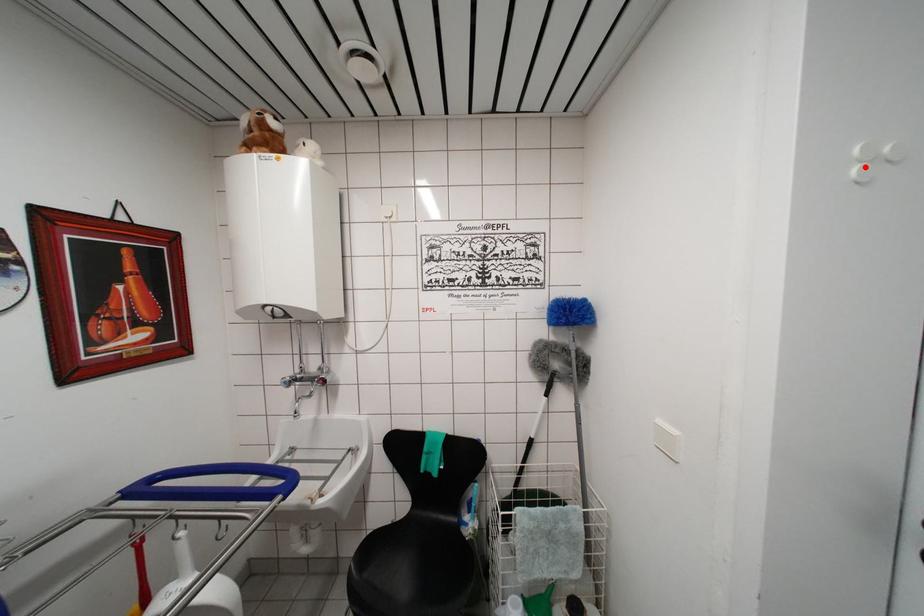
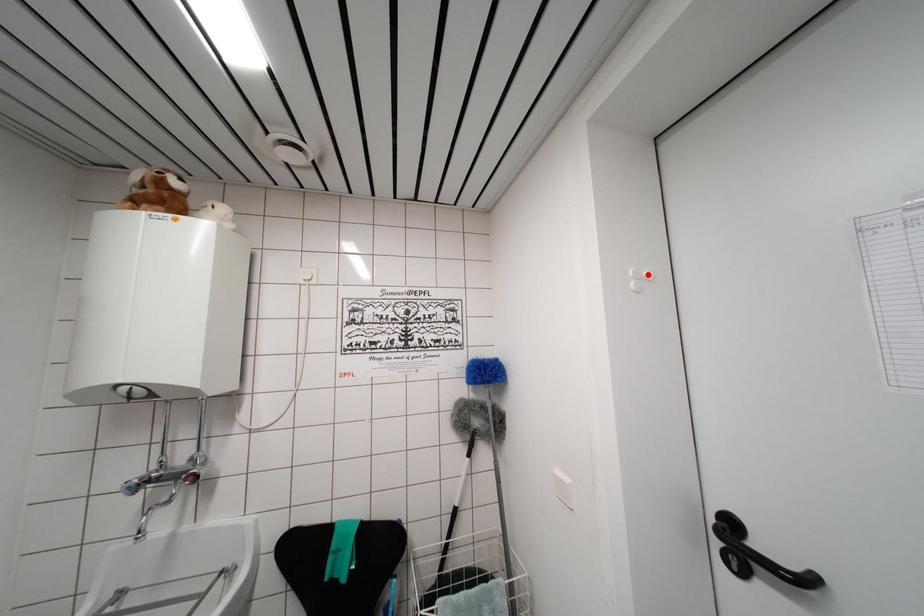
I am providing you with two images of the same scene from different viewpoints. A red point is marked on the first image and another point is marked on the second image. Are the points marked in image1 and image2 representing the same 3D position?

No